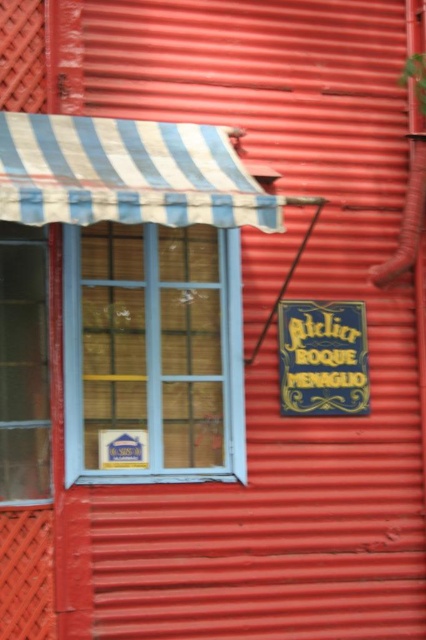
You are standing in front of a building with two windows. You need to hang a decoration that requires a window at least 1.2 meters tall. Which window between the blue painted wood window at center and the clear glass window at left can accommodate the decoration?

The clear glass window at left is taller than the blue painted wood window at center, so it can accommodate the decoration requiring at least 1.2 meters in height.

You are standing in front of the red corrugated metal wall and see the clear glass window at left and the blue painted wood sign at center right. Which object is located to the left of the other?

The clear glass window at left is positioned on the left side of blue painted wood sign at center right.